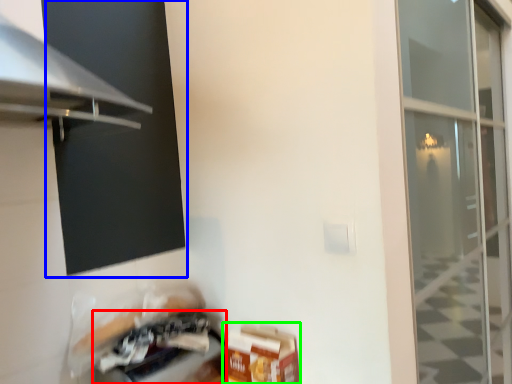
Question: Estimate the real-world distances between objects in this image. Which object is farther from appliance (highlighted by a red box), window screen (highlighted by a blue box) or cardboard box (highlighted by a green box)?

Choices:
 (A) window screen
 (B) cardboard box

Answer: (A)